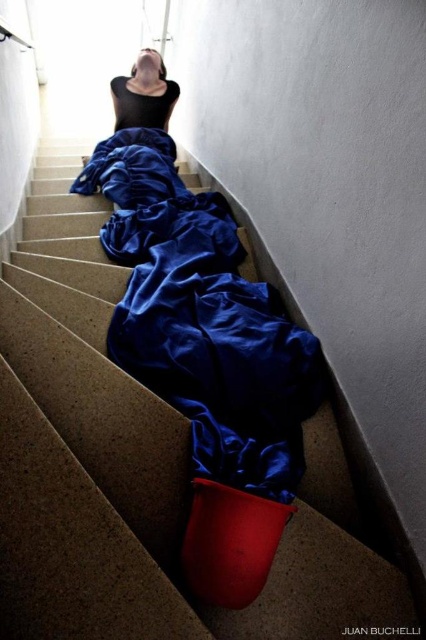
Between black matte fabric at center and blue satin robe at upper center, which one appears on the left side from the viewer's perspective?

black matte fabric at center

Measure the distance between black matte fabric at center and blue satin robe at upper center.

They are 2.20 centimeters apart.

Does point (169, 108) lie in front of point (126, 125)?

No, it is behind (126, 125).

Identify the location of black matte fabric at center. The width and height of the screenshot is (426, 640). (143, 93).